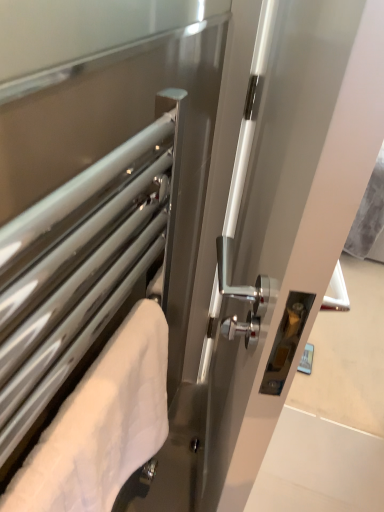
Question: Is white glossy handle at center, the 2th screen door positioned from the left, looking in the opposite direction of satin silver towel rack at left, positioned as the second screen door in right-to-left order?

Choices:
 (A) no
 (B) yes

Answer: (B)

Question: From the image's perspective, is white glossy handle at center, which is the 1th screen door in right-to-left order, on top of satin silver towel rack at left, positioned as the second screen door in right-to-left order?

Choices:
 (A) no
 (B) yes

Answer: (B)

Question: Considering the relative sizes of white glossy handle at center, which is the 1th screen door in right-to-left order, and satin silver towel rack at left, the 1th screen door in the left-to-right sequence, in the image provided, is white glossy handle at center, which is the 1th screen door in right-to-left order, wider than satin silver towel rack at left, the 1th screen door in the left-to-right sequence,?

Choices:
 (A) yes
 (B) no

Answer: (A)

Question: Is satin silver towel rack at left, the 1th screen door in the left-to-right sequence, located within white glossy handle at center, the 2th screen door positioned from the left?

Choices:
 (A) no
 (B) yes

Answer: (A)

Question: From a real-world perspective, does white glossy handle at center, which is the 1th screen door in right-to-left order, stand above satin silver towel rack at left, the 1th screen door in the left-to-right sequence?

Choices:
 (A) no
 (B) yes

Answer: (A)

Question: Considering the positions of white glossy handle at center, the 2th screen door positioned from the left, and white fluffy towel at left in the image, is white glossy handle at center, the 2th screen door positioned from the left, taller or shorter than white fluffy towel at left?

Choices:
 (A) tall
 (B) short

Answer: (A)

Question: Considering the positions of white glossy handle at center, the 2th screen door positioned from the left, and white fluffy towel at left in the image, is white glossy handle at center, the 2th screen door positioned from the left, bigger or smaller than white fluffy towel at left?

Choices:
 (A) big
 (B) small

Answer: (A)

Question: From a real-world perspective, is white glossy handle at center, which is the 1th screen door in right-to-left order, positioned above or below white fluffy towel at left?

Choices:
 (A) below
 (B) above

Answer: (A)

Question: In the image, is white glossy handle at center, which is the 1th screen door in right-to-left order, positioned in front of or behind white fluffy towel at left?

Choices:
 (A) behind
 (B) front

Answer: (B)

Question: From a real-world perspective, is white glossy handle at center, the 2th screen door positioned from the left, positioned above or below satin silver towel rack at left, the 1th screen door in the left-to-right sequence?

Choices:
 (A) above
 (B) below

Answer: (B)

Question: Is white glossy handle at center, which is the 1th screen door in right-to-left order, situated inside satin silver towel rack at left, positioned as the second screen door in right-to-left order, or outside?

Choices:
 (A) inside
 (B) outside

Answer: (B)

Question: From their relative heights in the image, would you say white glossy handle at center, which is the 1th screen door in right-to-left order, is taller or shorter than satin silver towel rack at left, positioned as the second screen door in right-to-left order?

Choices:
 (A) short
 (B) tall

Answer: (B)

Question: Is point (249, 481) positioned closer to the camera than point (69, 248)?

Choices:
 (A) closer
 (B) farther

Answer: (B)

Question: Looking at the image, does white fluffy towel at left seem bigger or smaller compared to satin silver towel rack at left, positioned as the second screen door in right-to-left order?

Choices:
 (A) small
 (B) big

Answer: (A)

Question: Looking at their shapes, would you say white fluffy towel at left is wider or thinner than satin silver towel rack at left, the 1th screen door in the left-to-right sequence?

Choices:
 (A) wide
 (B) thin

Answer: (B)